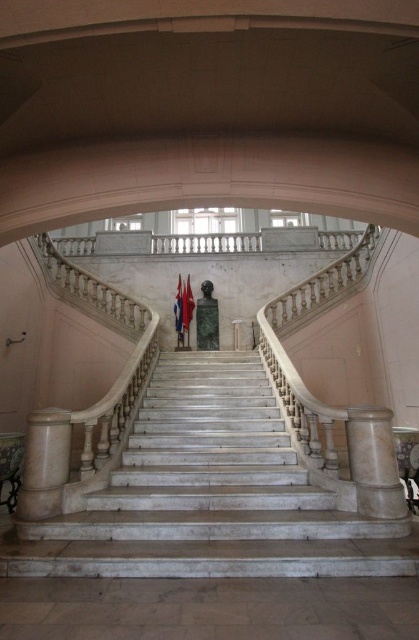
Question: Which of the following is the farthest from the observer?

Choices:
 (A) (167, 508)
 (B) (362, 500)

Answer: (A)

Question: From the image, what is the correct spatial relationship of white marble staircase at center in relation to white marble pillar at lower left?

Choices:
 (A) above
 (B) below

Answer: (B)

Question: Among these points, which one is nearest to the camera?

Choices:
 (A) (134, 470)
 (B) (361, 497)
 (C) (38, 436)

Answer: (B)

Question: Is white marble staircase at center below white marble pillar at lower right?

Choices:
 (A) no
 (B) yes

Answer: (B)

Question: Considering the real-world distances, which object is closest to the white marble pillar at lower left?

Choices:
 (A) white marble staircase at center
 (B) white marble pillar at lower right

Answer: (A)

Question: Does white marble staircase at center have a greater width compared to white marble pillar at lower left?

Choices:
 (A) yes
 (B) no

Answer: (A)